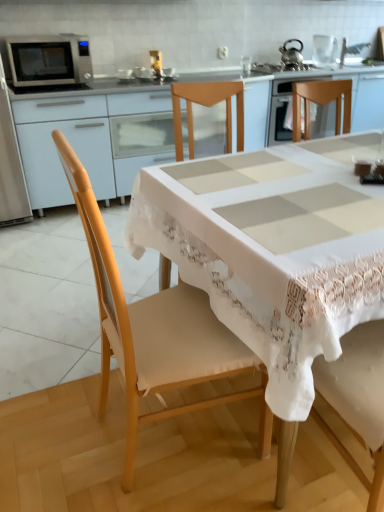
The width and height of the screenshot is (384, 512). Find the location of `vacant location below wooden chair at center (from a real-world perspective)`. vacant location below wooden chair at center (from a real-world perspective) is located at coordinates [x=164, y=448].